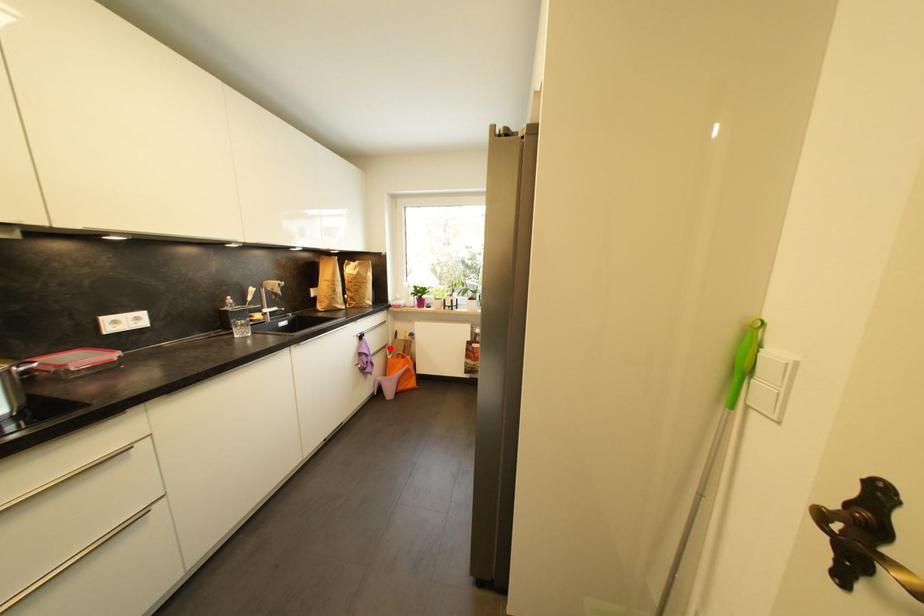
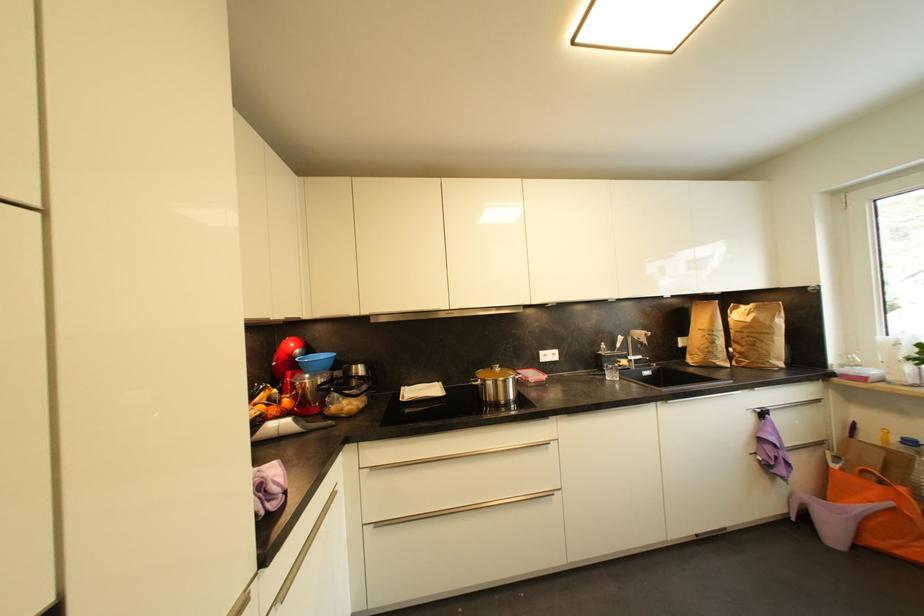
Where in the second image is the point corresponding to the highlighted location from the first image?

(825, 446)